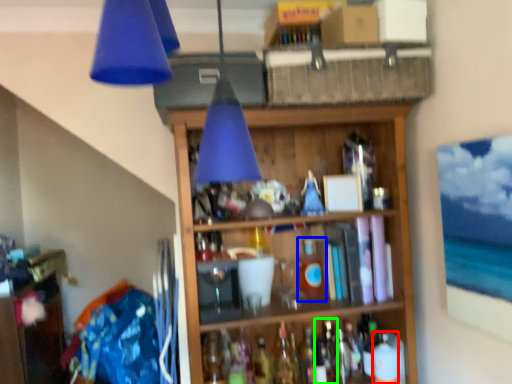
Question: Which object is the closest to the bottle (highlighted by a red box)? Choose among these: bottle (highlighted by a blue box) or bottle (highlighted by a green box).

Choices:
 (A) bottle
 (B) bottle

Answer: (B)